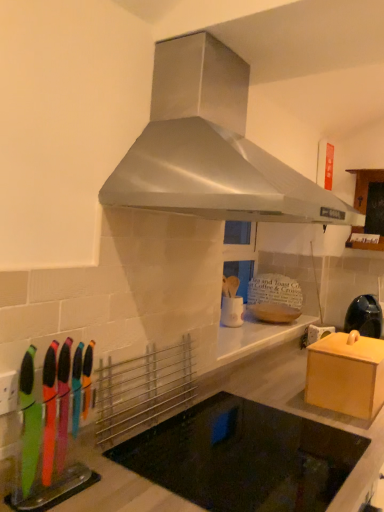
Question: From a real-world perspective, is stainless steel range hood at upper center physically located above or below black glass cooktop at center?

Choices:
 (A) above
 (B) below

Answer: (A)

Question: Is point (183, 117) positioned closer to the camera than point (251, 420)?

Choices:
 (A) farther
 (B) closer

Answer: (B)

Question: Estimate the real-world distances between objects in this image. Which object is farther from the black glass cooktop at center?

Choices:
 (A) wooden cabinet at upper right, positioned as the 2th cabinetry in front-to-back order
 (B) stainless steel range hood at upper center
 (C) wooden box at right, marked as the 1th cabinetry in a left-to-right arrangement
 (D) matte black kettle at right

Answer: (A)

Question: Estimate the real-world distances between objects in this image. Which object is farther from the wooden box at right, the 1th cabinetry from the bottom?

Choices:
 (A) black glass cooktop at center
 (B) stainless steel range hood at upper center
 (C) matte black kettle at right
 (D) wooden cabinet at upper right, acting as the first cabinetry starting from the right

Answer: (D)